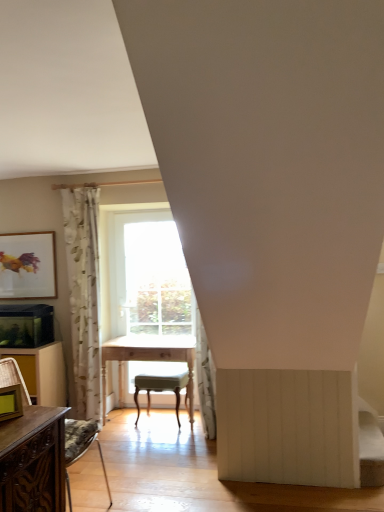
Question: Looking at the image, does white floral fabric curtain at left seem bigger or smaller compared to light wood table at center?

Choices:
 (A) small
 (B) big

Answer: (A)

Question: Looking at their shapes, would you say white floral fabric curtain at left is wider or thinner than light wood table at center?

Choices:
 (A) wide
 (B) thin

Answer: (B)

Question: Which object is positioned closest to the white floral fabric curtain at left?

Choices:
 (A) matte gold picture frame at lower left, the 1th picture frame from the right
 (B) wooden chair at left
 (C) light wood table at center
 (D) brown wood dresser at lower left
 (E) matte gold picture frame at left, the 2th picture frame positioned from the right

Answer: (D)

Question: Which object is positioned farthest from the matte gold picture frame at left, the 2th picture frame when ordered from bottom to top?

Choices:
 (A) white floral fabric curtain at left
 (B) matte gold picture frame at lower left, placed as the second picture frame when sorted from back to front
 (C) brown wood dresser at lower left
 (D) light green fabric stool at center
 (E) light wood table at center

Answer: (B)